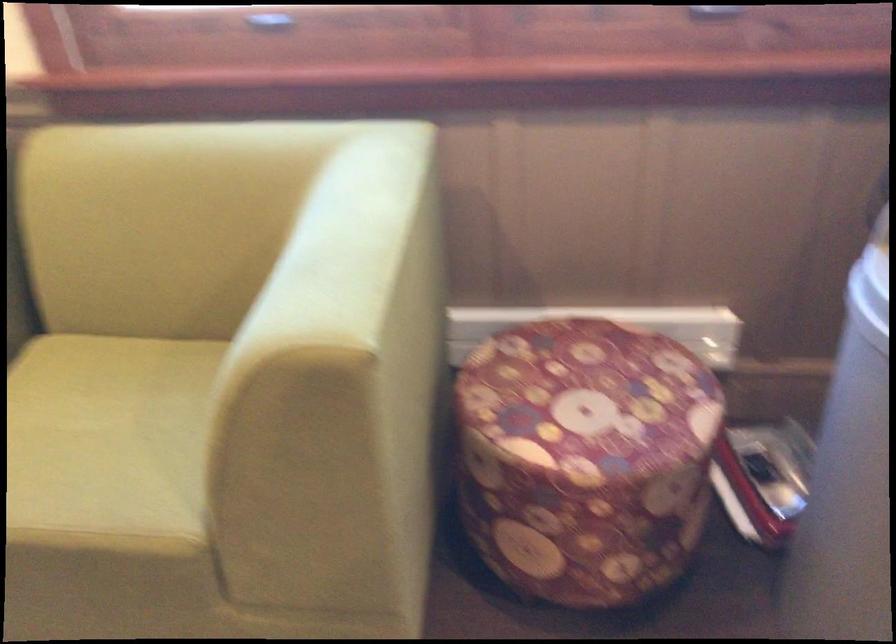
I want to click on yellow chair sitting surface, so click(107, 442).